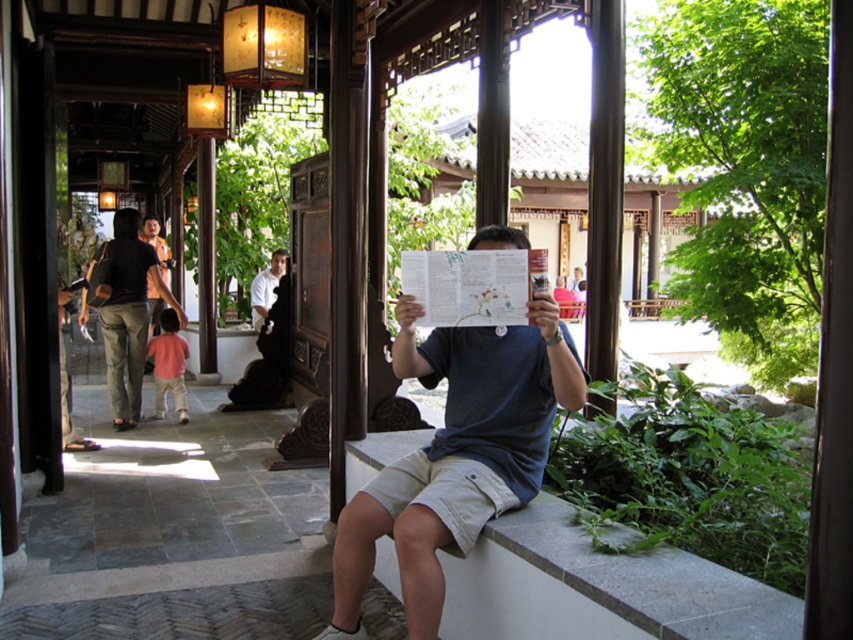
You are standing at the entrance of the garden and want to reach the point marked at coordinates point [459,618]. If your walking speed is 3 feet per second, how many seconds will it take you to reach the point?

The distance to point [459,618] is 10.00 feet. At a speed of 3 feet per second, it would take approximately 3.33 seconds to reach the point.

You are a visitor in this traditional Chinese garden and see the white stone ledge at center and the white shirt at center. Which object takes up more area in the image?

The white shirt at center takes up more area than the white stone ledge at center.